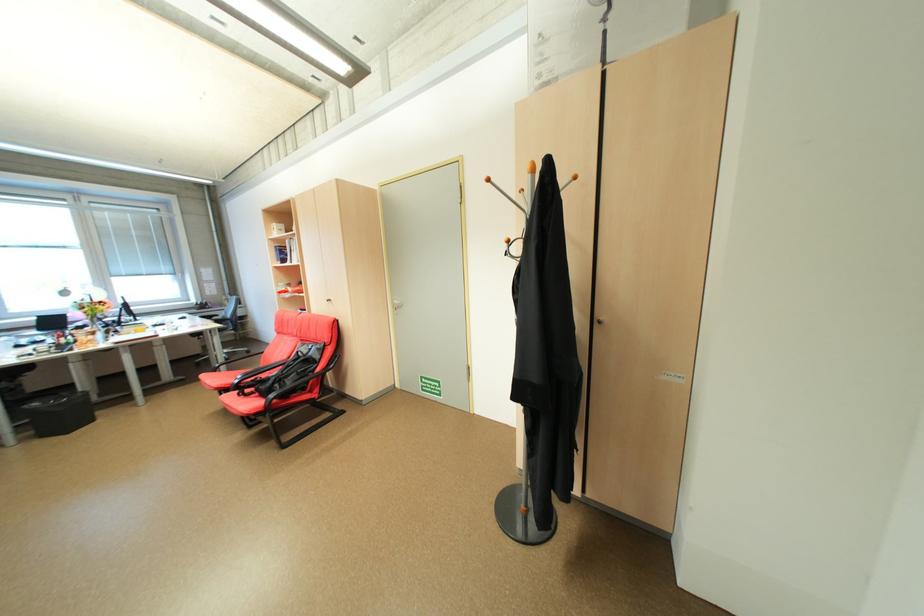
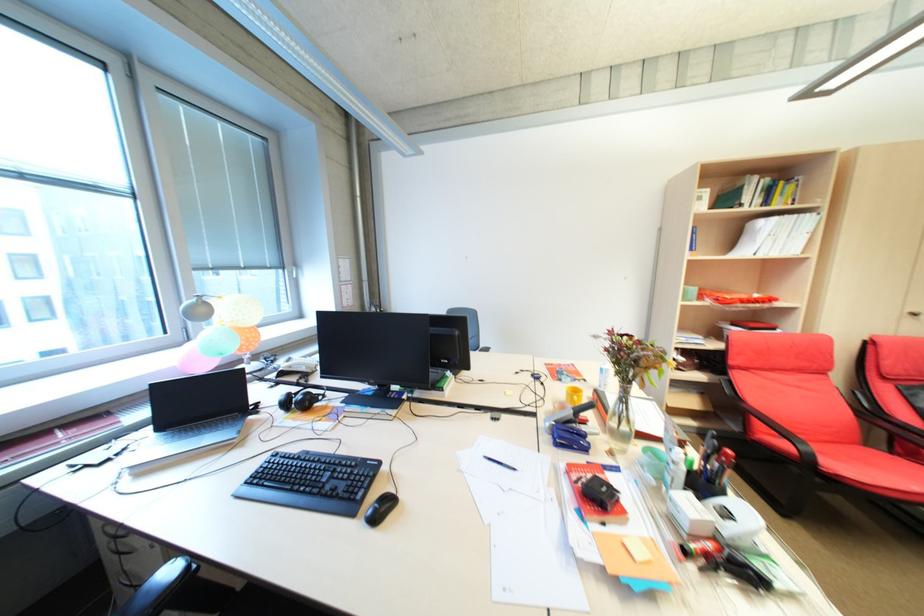
Question: I am providing you with two images of the same scene from different viewpoints. Please identify which objects are invisible in image2.

Choices:
 (A) colorful round container
 (B) black computer keyboard
 (C) black chair armrest
 (D) black pen

Answer: (C)